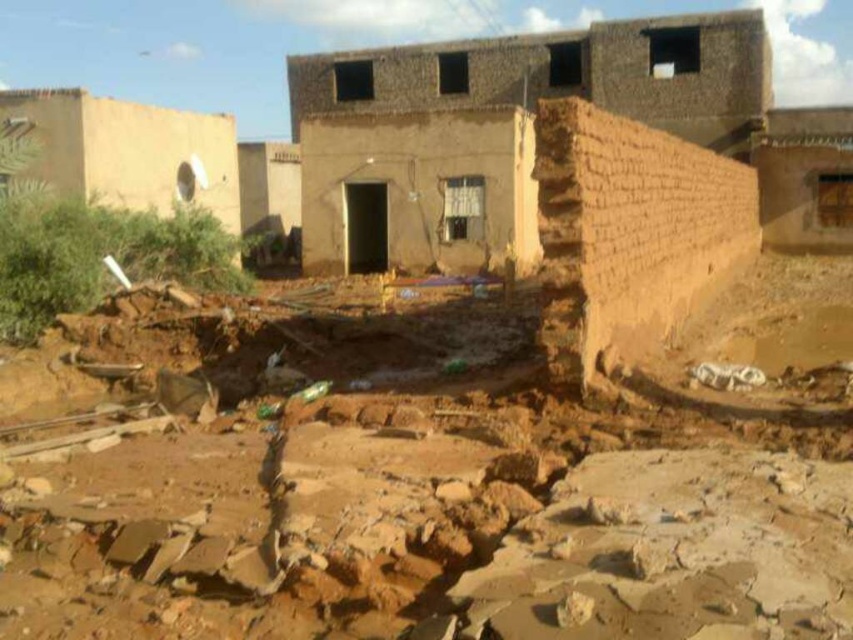
Consider the image. Can you confirm if brown clay mud at center is positioned to the right of brown mud-brick house at center?

Indeed, brown clay mud at center is positioned on the right side of brown mud-brick house at center.

Is point (466, 515) positioned before point (76, 19)?

Yes, point (466, 515) is in front of point (76, 19).

Where is `brown clay mud at center`? The image size is (853, 640). brown clay mud at center is located at coordinates (422, 497).